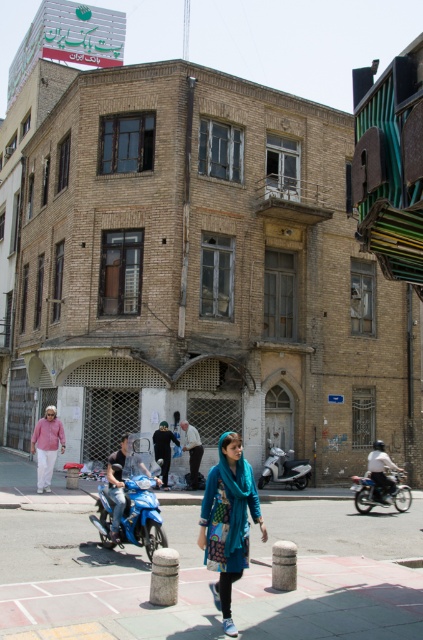
You are a pedestrian standing on the street in front of the building. You see a matte pink sweater at lower left and a light brown leather jacket at center. Which clothing item is closer to you?

The matte pink sweater at lower left is closer to you because it is in front of the light brown leather jacket at center.

You are a fashion designer observing the urban street scene. You notice two jackets at the center of the image. Which jacket is taller, the blue fabric jacket at center or the light brown leather jacket at center?

The blue fabric jacket at center is taller than the light brown leather jacket at center according to the description.